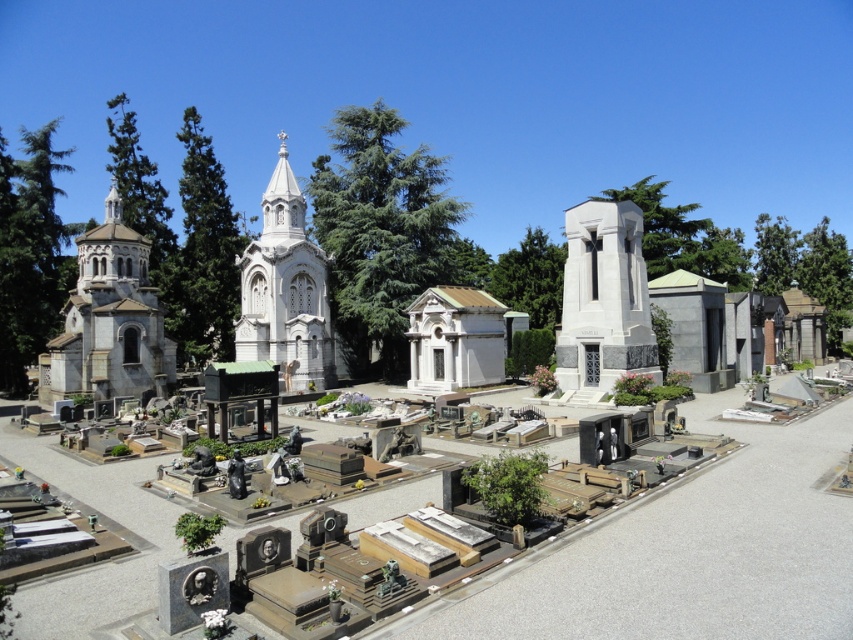
Question: Can you confirm if white marble monument at center is positioned to the right of white marble church at center?

Choices:
 (A) no
 (B) yes

Answer: (B)

Question: Is white marble church at left positioned behind white marble church at center?

Choices:
 (A) yes
 (B) no

Answer: (B)

Question: Which point appears farthest from the camera in this image?

Choices:
 (A) (585, 292)
 (B) (291, 304)

Answer: (B)

Question: Considering the real-world distances, which object is farthest from the white marble church at center?

Choices:
 (A) white marble monument at center
 (B) white marble church at left

Answer: (A)

Question: Considering the real-world distances, which object is farthest from the white marble church at left?

Choices:
 (A) white marble monument at center
 (B) white marble church at center

Answer: (A)

Question: Does white marble monument at center have a smaller size compared to white marble church at center?

Choices:
 (A) yes
 (B) no

Answer: (A)